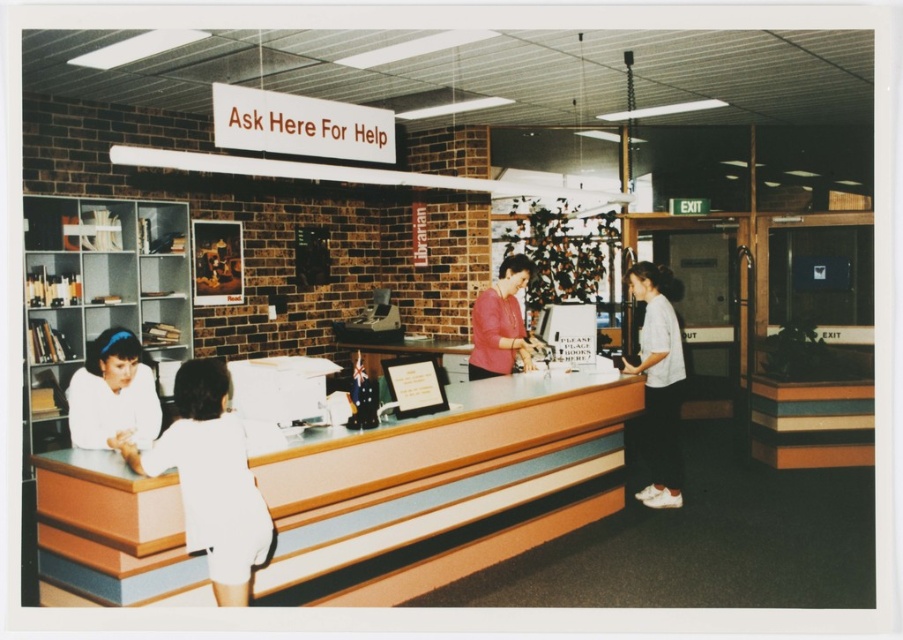
Is wooden counter at center above white fabric shirt at lower left?

Incorrect, wooden counter at center is not positioned above white fabric shirt at lower left.

Identify the location of wooden counter at center. This screenshot has width=903, height=640. (445, 476).

Does wooden counter at center appear on the right side of white cotton shirt at right?

No, wooden counter at center is not to the right of white cotton shirt at right.

Is wooden counter at center below white cotton shirt at right?

Indeed, wooden counter at center is positioned under white cotton shirt at right.

Does point (573, 508) come farther from viewer compared to point (659, 284)?

No, (573, 508) is in front of (659, 284).

Where is `wooden counter at center`? wooden counter at center is located at coordinates (445, 476).

Between point (221, 449) and point (129, 349), which one is positioned in front?

Point (221, 449)

Which of these two, white fabric shirt at lower left or white fabric shirt at left, stands shorter?

With less height is white fabric shirt at left.

Which is in front, point (219, 508) or point (75, 404)?

Positioned in front is point (219, 508).

Where is `white fabric shirt at lower left`? The height and width of the screenshot is (640, 903). white fabric shirt at lower left is located at coordinates (211, 480).